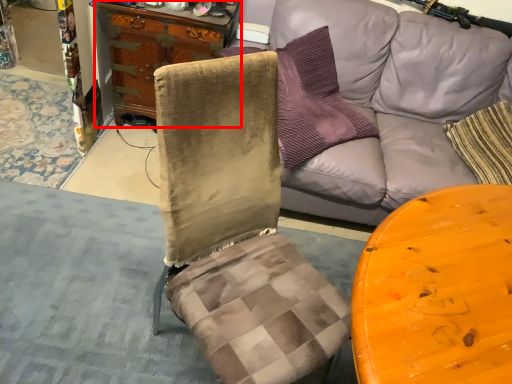
Question: From the image's perspective, what is the correct spatial relationship of cabinetry (annotated by the red box) in relation to studio couch?

Choices:
 (A) above
 (B) below

Answer: (A)